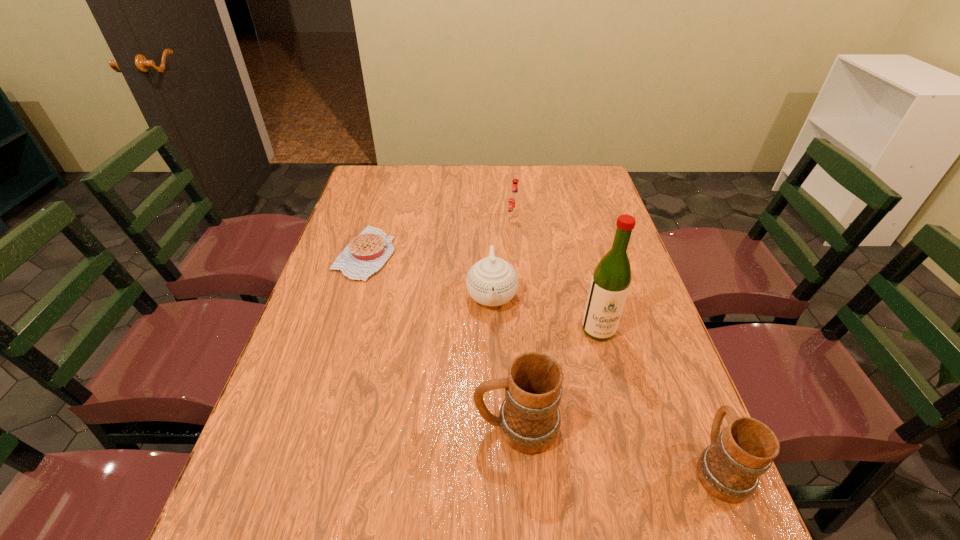
Find the location of a particular element. The image size is (960, 540). vacant area situated 0.330m on the side of the taller mug with the handle is located at coordinates (315, 427).

The width and height of the screenshot is (960, 540). What are the coordinates of `free space located 0.050m on the side of the taller mug with the handle` in the screenshot? It's located at (450, 427).

Where is `free space located 0.270m on the side of the taller mug with the handle`? The image size is (960, 540). free space located 0.270m on the side of the taller mug with the handle is located at coordinates (344, 427).

I want to click on free space located on the side of the shorter mug with the handle, so click(665, 336).

This screenshot has width=960, height=540. What are the coordinates of `vacant space located 0.230m on the side of the shorter mug with the handle` in the screenshot? It's located at (669, 346).

Image resolution: width=960 pixels, height=540 pixels. Identify the location of free region located 0.120m on the side of the shorter mug with the handle. (684, 383).

At what (x,y) coordinates should I click in order to perform the action: click on vacant space positioned 0.200m on the right of the root beer. Please return your answer as a coordinate pair (x, y). Image resolution: width=960 pixels, height=540 pixels. Looking at the image, I should click on (x=579, y=218).

Locate an element on the screen. The height and width of the screenshot is (540, 960). vacant space positioned on the label of the tallest object is located at coordinates (608, 366).

Where is `free space located 0.090m on the back of the shortest object`? The image size is (960, 540). free space located 0.090m on the back of the shortest object is located at coordinates (378, 212).

The height and width of the screenshot is (540, 960). What are the coordinates of `vacant area situated 0.280m on the spout of the chinaware` in the screenshot? It's located at point(495,420).